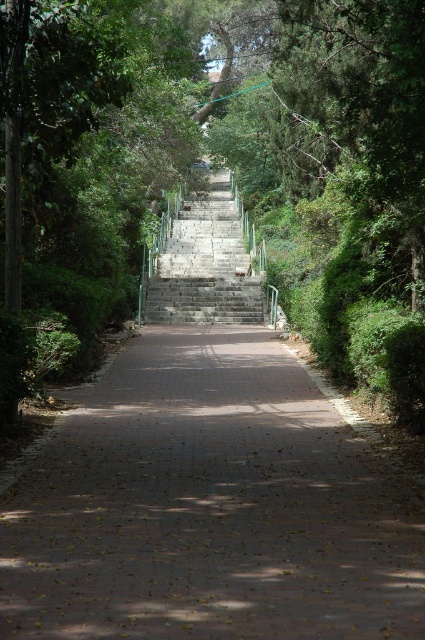
You are a delivery person carrying a heavy package and need to walk up the brown brick path at center and the gray stone stairs at center. Which one will require you to exert more effort due to its height?

The gray stone stairs at center require more effort because they are taller than the brown brick path at center.

You are standing at the entrance of the pathway in the image. There is a point marked at coordinates (x=209, y=508) which marks the brown brick path at center. If you walk straight ahead along the path, will you eventually reach the stone steps?

Yes, because the point marked at (x=209, y=508) indicates the brown brick path at center, and since the pathway leads up to the stone steps, walking straight along the path will lead you to the stone steps.